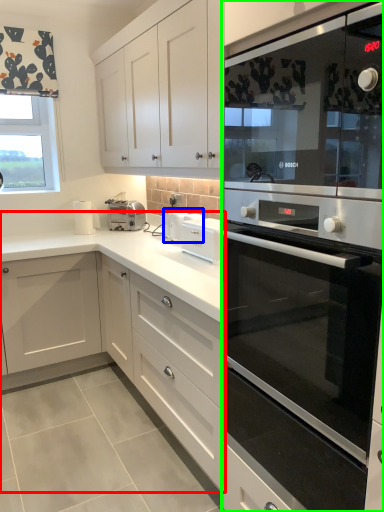
Question: Which object is positioned closest to cabinetry (highlighted by a red box)? Select from appliance (highlighted by a blue box) and home appliance (highlighted by a green box).

Choices:
 (A) appliance
 (B) home appliance

Answer: (A)